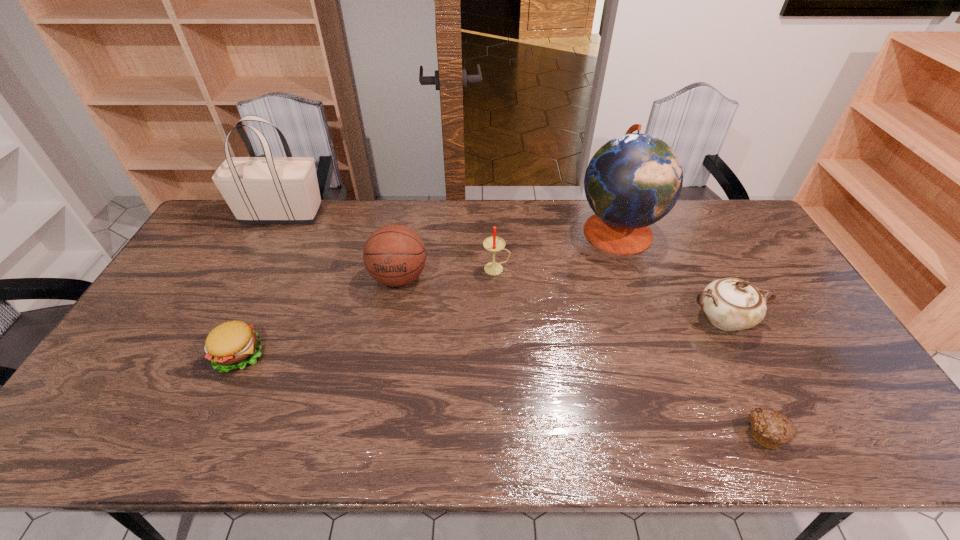
You are a GUI agent. You are given a task and a screenshot of the screen. Output one action in this format:
    pyautogui.click(x=<x>, y=<y>)
    Task: Click on the globe
    The height and width of the screenshot is (540, 960).
    Given the screenshot: What is the action you would take?
    pyautogui.click(x=634, y=180)

The height and width of the screenshot is (540, 960). Identify the location of shopping bag. (259, 190).

You are a GUI agent. You are given a task and a screenshot of the screen. Output one action in this format:
    pyautogui.click(x=<x>, y=<y>)
    Task: Click on the third object from left to right
    This screenshot has width=960, height=540.
    Given the screenshot: What is the action you would take?
    pyautogui.click(x=394, y=255)

Image resolution: width=960 pixels, height=540 pixels. Identify the location of the fourth object from right to left. [x=493, y=244].

Identify the location of chinaware. (731, 304).

Locate an element on the screen. the sixth tallest object is located at coordinates (231, 345).

Identify the location of muffin. (770, 429).

Locate an element on the screen. The image size is (960, 540). the shortest object is located at coordinates (770, 429).

The width and height of the screenshot is (960, 540). What are the coordinates of `free location located with the Americas facing the viewer on the globe` in the screenshot? It's located at (509, 230).

Find the location of `blank area located with the Americas facing the viewer on the globe`. blank area located with the Americas facing the viewer on the globe is located at coordinates (549, 230).